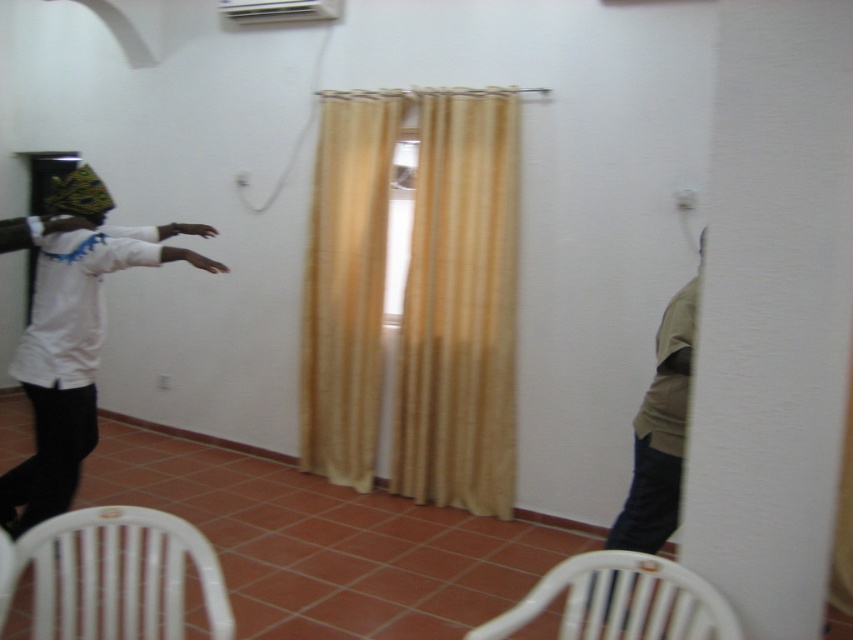
Question: Which of the following is the farthest from the observer?

Choices:
 (A) (688, 326)
 (B) (160, 625)
 (C) (154, 243)

Answer: (C)

Question: Which point appears closest to the camera in this image?

Choices:
 (A) 329,12
 (B) 78,515

Answer: (B)

Question: Which point is farther to the camera?

Choices:
 (A) (680, 428)
 (B) (113, 520)

Answer: (A)

Question: Is white plastic chair at lower left bigger than khaki fabric shirt at right?

Choices:
 (A) yes
 (B) no

Answer: (B)

Question: In this image, where is white plastic chair at lower left located relative to khaki fabric shirt at right?

Choices:
 (A) below
 (B) above

Answer: (A)

Question: Is white plastic chair at lower center bigger than khaki fabric shirt at right?

Choices:
 (A) yes
 (B) no

Answer: (B)